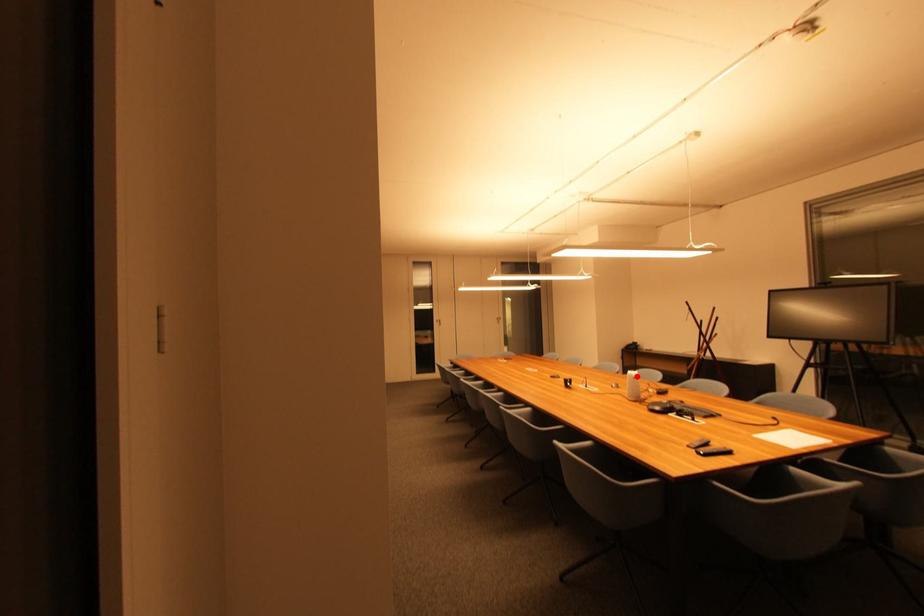
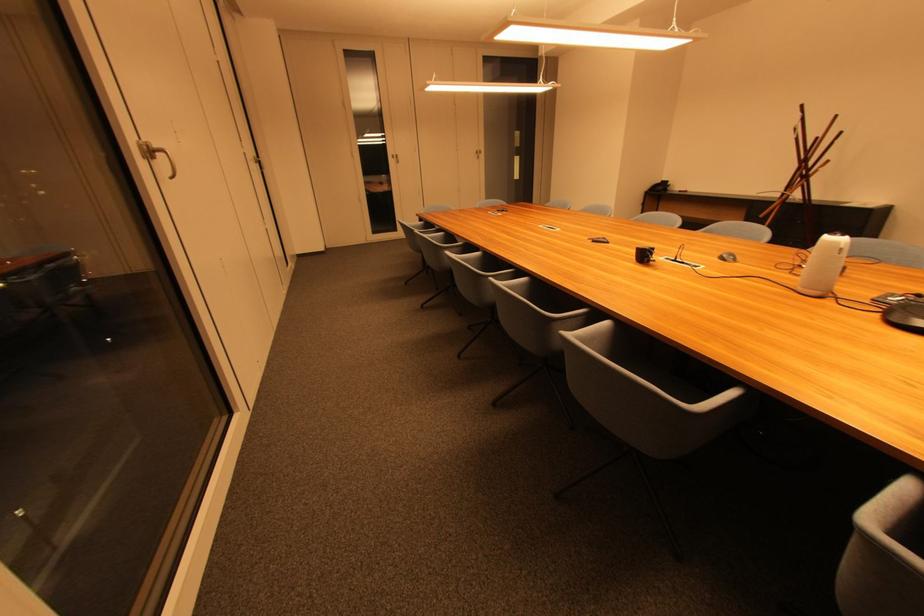
The point at the highlighted location is marked in the first image. Where is the corresponding point in the second image?

(841, 245)